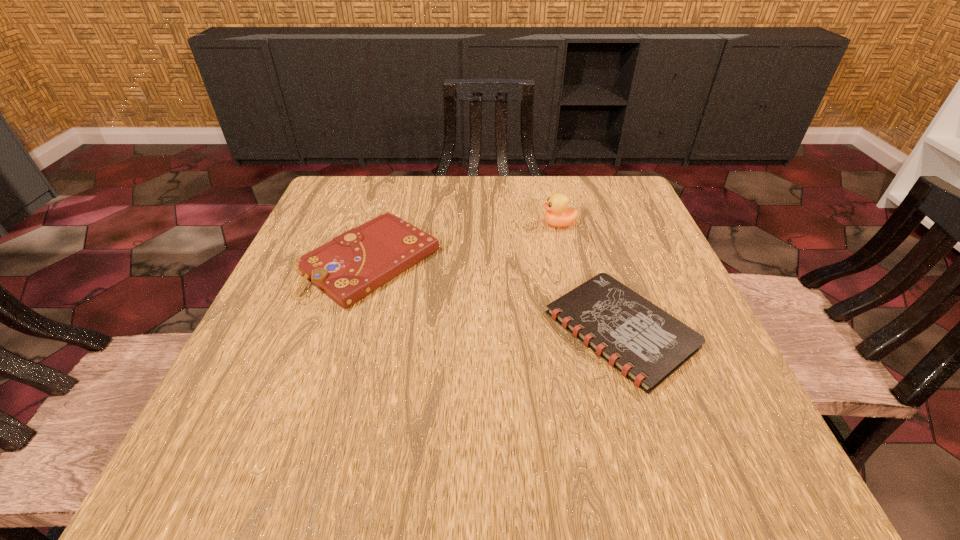
I want to click on duckling that is at the far edge, so click(x=558, y=214).

At what (x,y) coordinates should I click in order to perform the action: click on notebook situated at the far edge. Please return your answer as a coordinate pair (x, y). The width and height of the screenshot is (960, 540). Looking at the image, I should click on (351, 266).

Where is `object that is at the left edge`? object that is at the left edge is located at coordinates (351, 266).

This screenshot has height=540, width=960. In order to click on object that is at the right edge in this screenshot , I will do `click(646, 344)`.

The height and width of the screenshot is (540, 960). What are the coordinates of `object present at the far left corner` in the screenshot? It's located at (351, 266).

In the image, there is a desktop. At what (x,y) coordinates should I click in order to perform the action: click on vacant area at the far edge. Please return your answer as a coordinate pair (x, y). Looking at the image, I should click on (568, 180).

Identify the location of vacant area at the near edge. (510, 434).

Where is `blank area at the left edge`? blank area at the left edge is located at coordinates (272, 384).

The image size is (960, 540). I want to click on vacant region at the right edge of the desktop, so click(602, 256).

I want to click on free region at the far left corner of the desktop, so click(x=354, y=183).